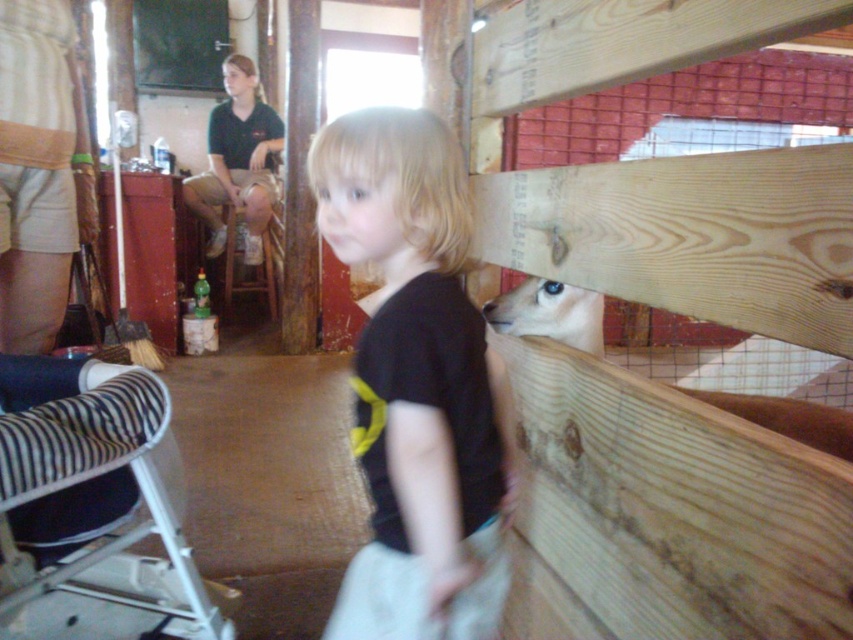
Does point (370, 124) lie behind point (532, 282)?

No.

Measure the distance between point (428, 600) and camera.

37.81 inches

At what (x,y) coordinates should I click in order to perform the action: click on black matte shirt at center. Please return your answer as a coordinate pair (x, y). This screenshot has width=853, height=640. Looking at the image, I should click on (415, 384).